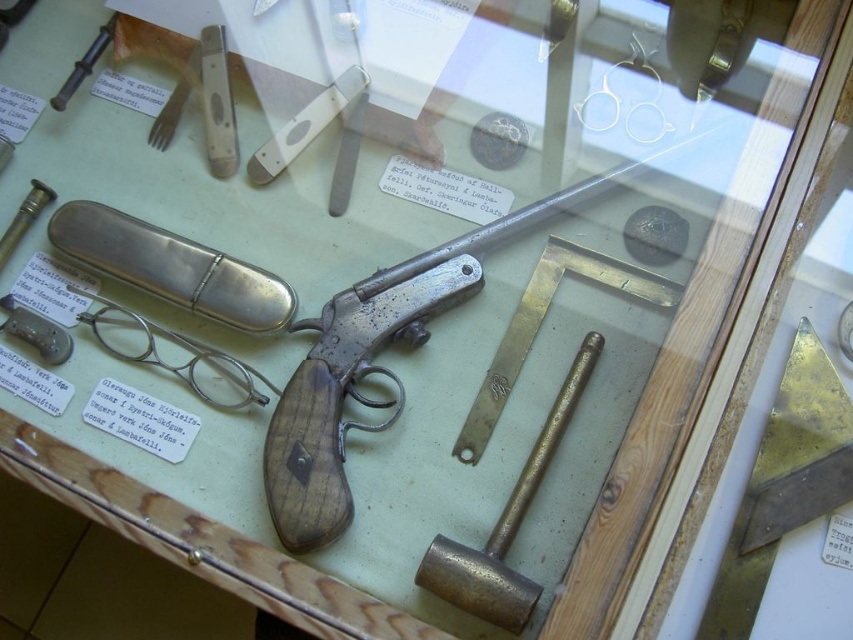
You are a museum security guard checking the layout of the display case. You need to ensure that the matte silver handgun at center and the matte silver bullet at left are positioned so that the narrower object is closer to the window for better visibility. Which object should be moved closer to the window?

The matte silver bullet at left is narrower than the matte silver handgun at center. Therefore, the matte silver bullet at left should be moved closer to the window to comply with the requirement.

You are a visitor at the museum looking at the display case. There are two points marked on the glass cover of the case. The first point is at coordinates point [614,184] and the second is at point [463,576]. Which point is closer to you as you look at the display case?

Point [463,576] is closer to you because it is less further to the camera than point [614,184].